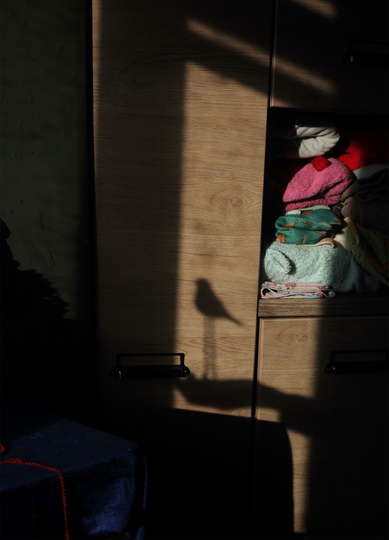
I want to click on wall, so click(19, 144).